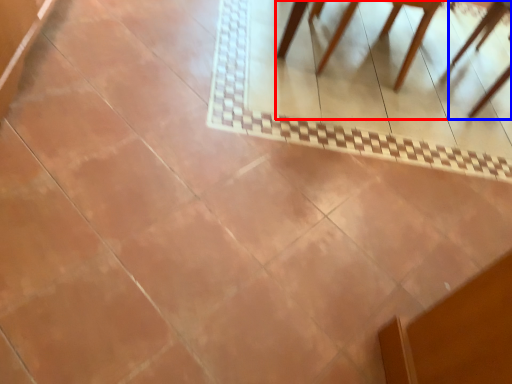
Question: Which object is further to the camera taking this photo, furniture (highlighted by a red box) or chair (highlighted by a blue box)?

Choices:
 (A) furniture
 (B) chair

Answer: (B)